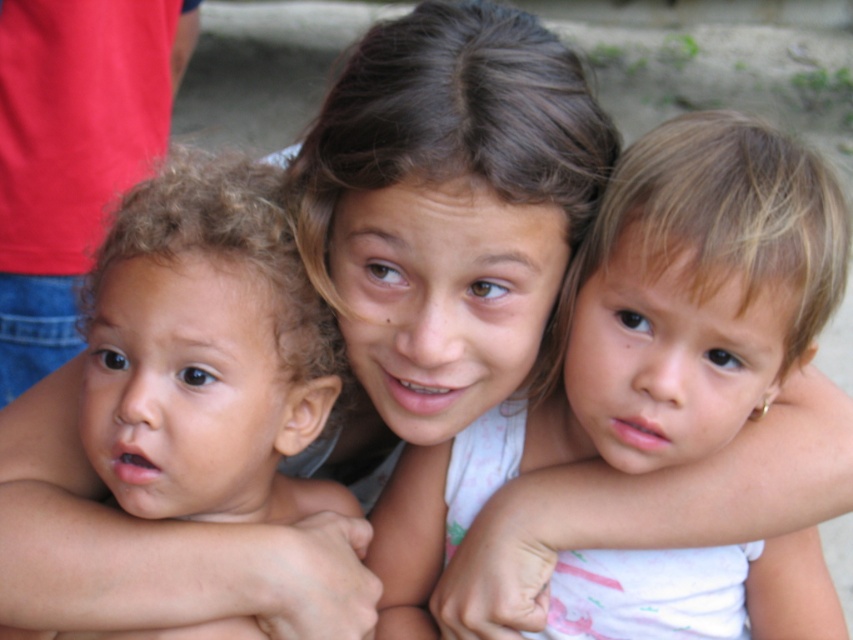
Question: Based on their relative distances, which object is nearer to the smooth skin child at center?

Choices:
 (A) white fabric at upper center
 (B) curly hair at left

Answer: (A)

Question: Is smooth skin child at center behind curly hair at left?

Choices:
 (A) yes
 (B) no

Answer: (A)

Question: Which object is the farthest from the smooth skin child at center?

Choices:
 (A) white fabric at upper center
 (B) curly hair at left

Answer: (B)

Question: Is smooth skin child at center to the right of curly hair at left from the viewer's perspective?

Choices:
 (A) no
 (B) yes

Answer: (B)

Question: Which object is closer to the camera taking this photo?

Choices:
 (A) white fabric at upper center
 (B) curly hair at left
 (C) smooth skin child at center

Answer: (B)

Question: Does smooth skin child at center have a larger size compared to white fabric at upper center?

Choices:
 (A) no
 (B) yes

Answer: (B)